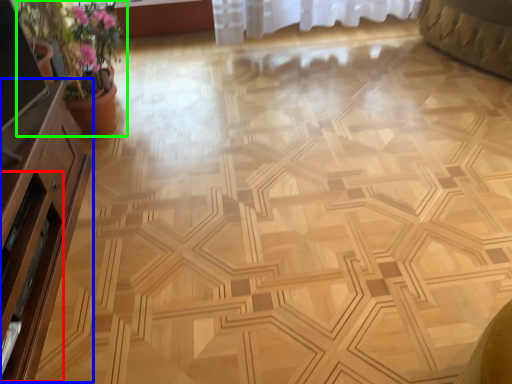
Question: Considering the real-world distances, which object is farthest from screen door (highlighted by a red box)? dresser (highlighted by a blue box) or houseplant (highlighted by a green box)?

Choices:
 (A) dresser
 (B) houseplant

Answer: (B)